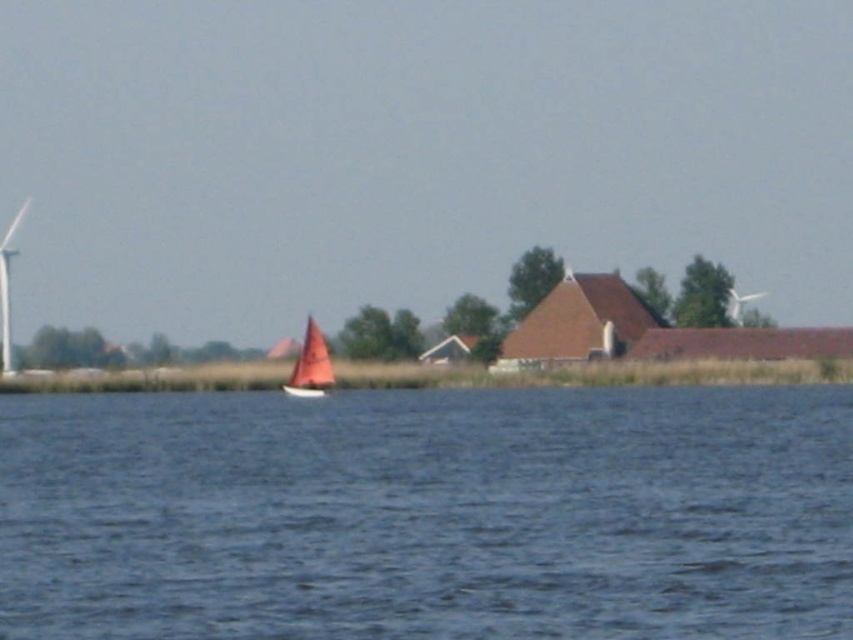
Question: Which of the following is the closest to the observer?

Choices:
 (A) (798, 557)
 (B) (316, 326)
 (C) (9, 308)

Answer: (A)

Question: Is blue water at center to the left of red sailboat at center from the viewer's perspective?

Choices:
 (A) no
 (B) yes

Answer: (A)

Question: Can you confirm if blue water at center is wider than red sailboat at center?

Choices:
 (A) no
 (B) yes

Answer: (B)

Question: Which of the following is the farthest from the observer?

Choices:
 (A) blue water at center
 (B) white plastic wind turbine at left

Answer: (B)

Question: Which point is farther from the camera taking this photo?

Choices:
 (A) (19, 211)
 (B) (300, 394)

Answer: (A)

Question: Is blue water at center to the right of white plastic wind turbine at left from the viewer's perspective?

Choices:
 (A) yes
 (B) no

Answer: (A)